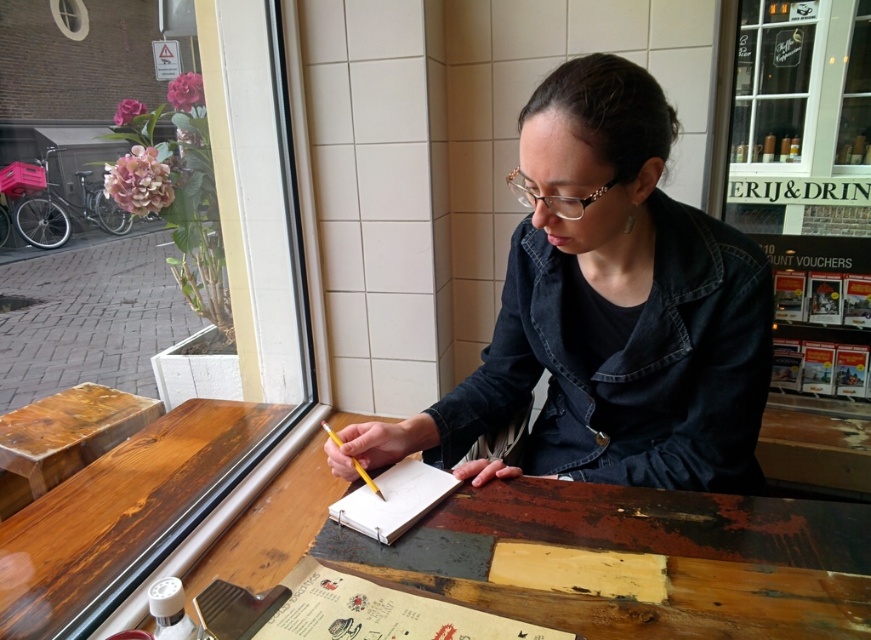
Question: Is clear glass window at upper right wider than wooden table at center?

Choices:
 (A) no
 (B) yes

Answer: (A)

Question: Which point is closer to the camera?

Choices:
 (A) (773, 145)
 (B) (253, 484)

Answer: (B)

Question: Is clear glass window at upper right further to camera compared to wooden table at center?

Choices:
 (A) yes
 (B) no

Answer: (A)

Question: Which point is closer to the camera?

Choices:
 (A) denim jacket at center
 (B) wooden table at center
 (C) clear glass window at upper right

Answer: (A)

Question: Which object is farther from the camera taking this photo?

Choices:
 (A) white paper notebook at center
 (B) clear glass window at upper right
 (C) denim jacket at center
 (D) wooden table at center

Answer: (B)

Question: Does clear glass window at upper right appear on the left side of white paper notebook at center?

Choices:
 (A) no
 (B) yes

Answer: (A)